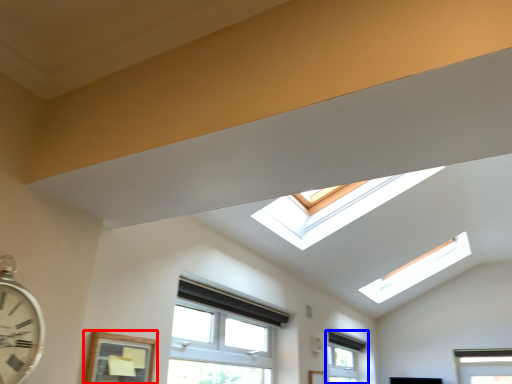
Question: Which point is closer to the camera, window (highlighted by a red box) or window (highlighted by a blue box)?

Choices:
 (A) window
 (B) window

Answer: (A)